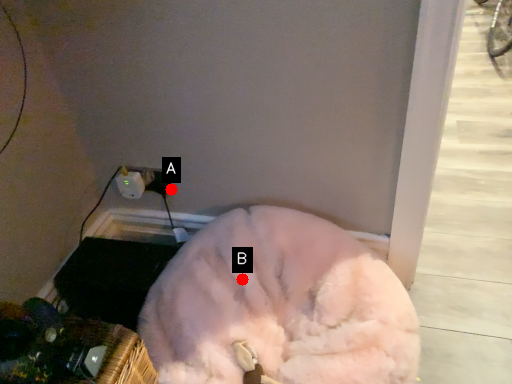
Question: Two points are circled on the image, labeled by A and B beside each circle. Which point is farther from the camera taking this photo?

Choices:
 (A) A is further
 (B) B is further

Answer: (A)